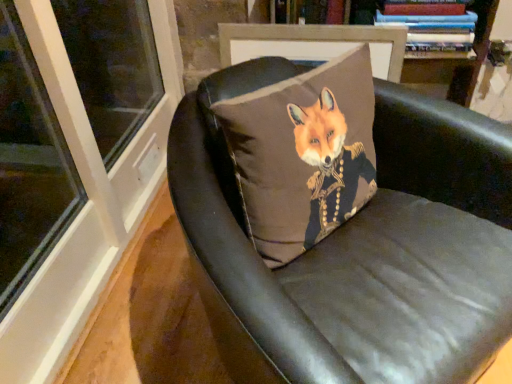
Question: Considering the relative sizes of hardcover books at upper right and matte brown pillow with fox design at center in the image provided, is hardcover books at upper right shorter than matte brown pillow with fox design at center?

Choices:
 (A) yes
 (B) no

Answer: (A)

Question: From a real-world perspective, is hardcover books at upper right on matte brown pillow with fox design at center?

Choices:
 (A) yes
 (B) no

Answer: (A)

Question: Is hardcover books at upper right not near matte brown pillow with fox design at center?

Choices:
 (A) no
 (B) yes

Answer: (A)

Question: Is the depth of hardcover books at upper right less than that of matte brown pillow with fox design at center?

Choices:
 (A) no
 (B) yes

Answer: (A)

Question: Can you confirm if hardcover books at upper right is positioned to the right of matte brown pillow with fox design at center?

Choices:
 (A) no
 (B) yes

Answer: (B)

Question: Is hardcover books at upper right smaller than matte brown pillow with fox design at center?

Choices:
 (A) no
 (B) yes

Answer: (B)

Question: From the image's perspective, is leather cushion at center over matte brown pillow with fox design at center?

Choices:
 (A) no
 (B) yes

Answer: (A)

Question: From a real-world perspective, does leather cushion at center sit lower than matte brown pillow with fox design at center?

Choices:
 (A) yes
 (B) no

Answer: (A)

Question: Is the depth of leather cushion at center less than that of matte brown pillow with fox design at center?

Choices:
 (A) no
 (B) yes

Answer: (B)

Question: Is leather cushion at center aimed at matte brown pillow with fox design at center?

Choices:
 (A) yes
 (B) no

Answer: (B)

Question: Is leather cushion at center looking in the opposite direction of matte brown pillow with fox design at center?

Choices:
 (A) no
 (B) yes

Answer: (B)

Question: Considering the relative sizes of leather cushion at center and matte brown pillow with fox design at center in the image provided, is leather cushion at center shorter than matte brown pillow with fox design at center?

Choices:
 (A) no
 (B) yes

Answer: (A)

Question: Can you confirm if hardcover books at upper right is bigger than leather cushion at center?

Choices:
 (A) no
 (B) yes

Answer: (A)